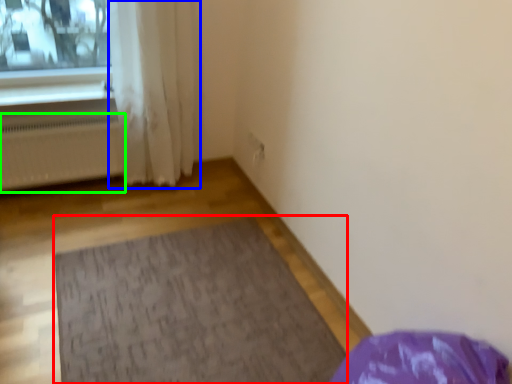
Question: Which is farther away from mat (highlighted by a red box)? curtain (highlighted by a blue box) or radiator (highlighted by a green box)?

Choices:
 (A) curtain
 (B) radiator

Answer: (B)